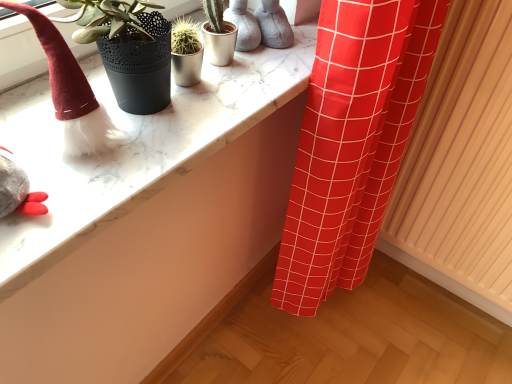
Question: Visually, is fuzzy red hat at left positioned to the left or to the right of marble counter top at upper left?

Choices:
 (A) right
 (B) left

Answer: (B)

Question: From the image's perspective, relative to marble counter top at upper left, is fuzzy red hat at left above or below?

Choices:
 (A) below
 (B) above

Answer: (A)

Question: Which object is positioned closest to the wooden radiator at right?

Choices:
 (A) fuzzy red hat at left
 (B) marble counter top at upper left

Answer: (B)

Question: Estimate the real-world distances between objects in this image. Which object is closer to the marble counter top at upper left?

Choices:
 (A) fuzzy red hat at left
 (B) wooden radiator at right

Answer: (A)